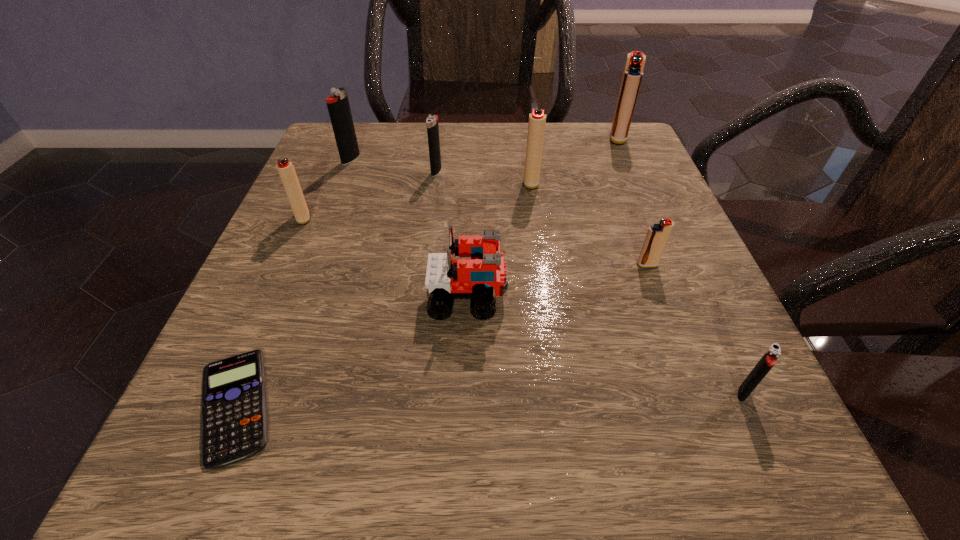
Find the location of `object situated at the near left corner`. object situated at the near left corner is located at coordinates (234, 420).

Find the location of `object positioned at the far right corner`. object positioned at the far right corner is located at coordinates (633, 72).

You are a GUI agent. You are given a task and a screenshot of the screen. Output one action in this format:
    pyautogui.click(x=<x>, y=<y>)
    Task: Click on the free space at the far edge of the desktop
    Image resolution: width=960 pixels, height=540 pixels.
    Given the screenshot: What is the action you would take?
    pyautogui.click(x=477, y=148)

Where is `vacant area at the near edge`? This screenshot has width=960, height=540. vacant area at the near edge is located at coordinates (459, 448).

The width and height of the screenshot is (960, 540). I want to click on vacant space at the left edge, so click(269, 369).

In the image, there is a desktop. What are the coordinates of `free space at the right edge` in the screenshot? It's located at [652, 221].

At what (x,y) coordinates should I click in order to perform the action: click on vacant space at the far left corner of the desktop. Please return your answer as a coordinate pair (x, y). The image size is (960, 540). Looking at the image, I should click on coord(381,168).

Locate an element on the screen. The width and height of the screenshot is (960, 540). vacant space at the far right corner is located at coordinates (566, 125).

Image resolution: width=960 pixels, height=540 pixels. Find the location of `free space between the nearest igniter and the fifth farthest object`. free space between the nearest igniter and the fifth farthest object is located at coordinates (523, 305).

You are a GUI agent. You are given a task and a screenshot of the screen. Output one action in this format:
    pyautogui.click(x=<x>, y=<y>)
    Task: Click on the empty location between the fifth igniter from right to left and the rightmost black igniter
    This screenshot has height=540, width=960.
    Given the screenshot: What is the action you would take?
    pyautogui.click(x=589, y=282)